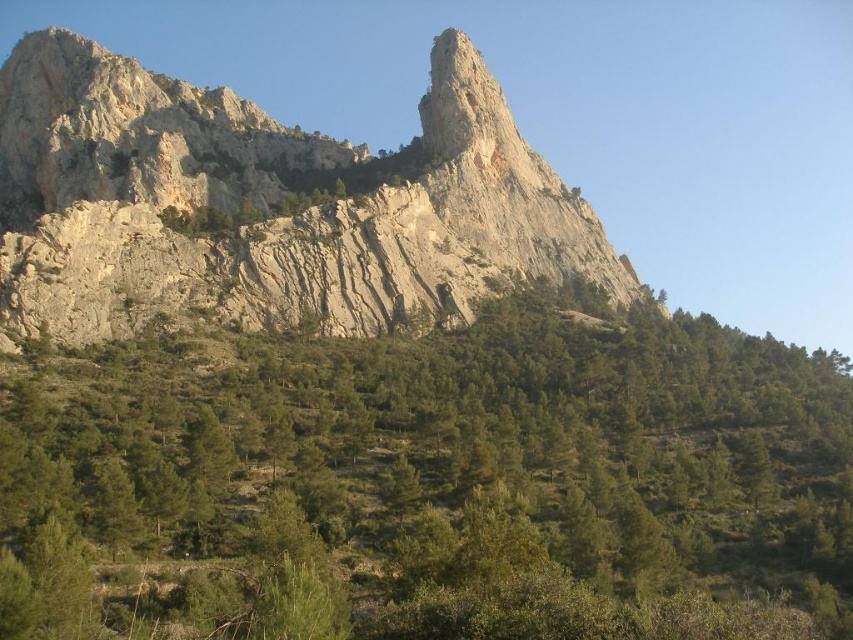
Measure the distance between green leafy trees at lower center and camera.

42.41 meters

You are a GUI agent. You are given a task and a screenshot of the screen. Output one action in this format:
    pyautogui.click(x=<x>, y=<y>)
    Task: Click on the green leafy trees at lower center
    The height and width of the screenshot is (640, 853).
    Given the screenshot: What is the action you would take?
    pyautogui.click(x=430, y=484)